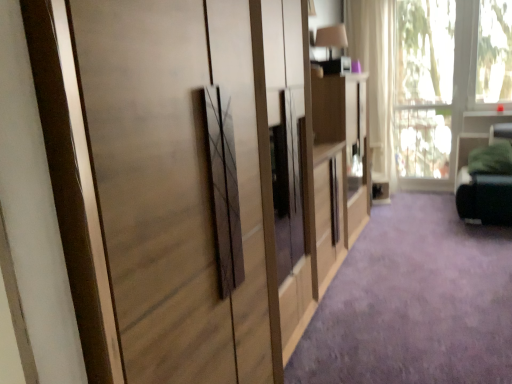
Question: Does matte wood dresser at center appear on the right side of white sheer curtain at upper right?

Choices:
 (A) yes
 (B) no

Answer: (B)

Question: Is matte wood dresser at center bigger than white sheer curtain at upper right?

Choices:
 (A) yes
 (B) no

Answer: (A)

Question: Does matte wood dresser at center lie in front of white sheer curtain at upper right?

Choices:
 (A) yes
 (B) no

Answer: (A)

Question: Does matte wood dresser at center have a greater width compared to white sheer curtain at upper right?

Choices:
 (A) yes
 (B) no

Answer: (A)

Question: Considering the relative sizes of matte wood dresser at center and white sheer curtain at upper right in the image provided, is matte wood dresser at center thinner than white sheer curtain at upper right?

Choices:
 (A) yes
 (B) no

Answer: (B)

Question: From a real-world perspective, does matte wood dresser at center sit lower than white sheer curtain at upper right?

Choices:
 (A) no
 (B) yes

Answer: (B)

Question: Can you confirm if transparent glass window at upper right is bigger than matte wood cupboard at center?

Choices:
 (A) no
 (B) yes

Answer: (A)

Question: Considering the relative sizes of transparent glass window at upper right and matte wood cupboard at center in the image provided, is transparent glass window at upper right taller than matte wood cupboard at center?

Choices:
 (A) no
 (B) yes

Answer: (B)

Question: From a real-world perspective, is transparent glass window at upper right over matte wood cupboard at center?

Choices:
 (A) no
 (B) yes

Answer: (B)

Question: From a real-world perspective, does transparent glass window at upper right sit lower than matte wood cupboard at center?

Choices:
 (A) no
 (B) yes

Answer: (A)

Question: Is transparent glass window at upper right looking in the opposite direction of matte wood cupboard at center?

Choices:
 (A) no
 (B) yes

Answer: (A)

Question: From the image's perspective, would you say transparent glass window at upper right is positioned over matte wood cupboard at center?

Choices:
 (A) yes
 (B) no

Answer: (A)

Question: From the image's perspective, is white sheer curtain at upper right on transparent glass window at upper right?

Choices:
 (A) no
 (B) yes

Answer: (B)